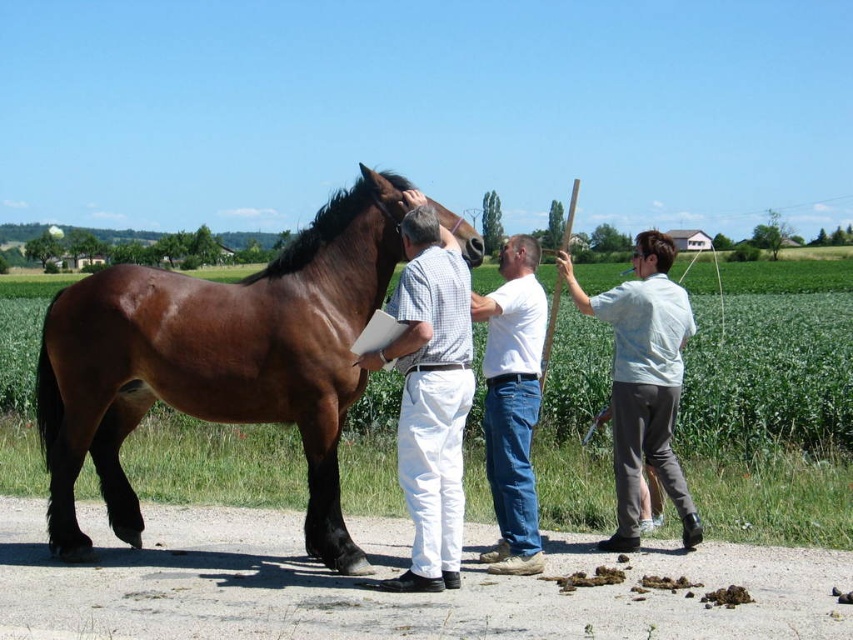
Question: Can you confirm if light blue shirt at right is positioned to the left of white cotton shirt at center?

Choices:
 (A) no
 (B) yes

Answer: (A)

Question: Which of these objects is positioned closest to the brown glossy horse at center?

Choices:
 (A) white cotton shirt at center
 (B) light blue shirt at right
 (C) white cotton pants at center

Answer: (C)

Question: Does light blue shirt at right appear under white cotton shirt at center?

Choices:
 (A) yes
 (B) no

Answer: (B)

Question: Which object appears closest to the camera in this image?

Choices:
 (A) light blue shirt at right
 (B) white cotton pants at center
 (C) white cotton shirt at center

Answer: (B)

Question: Which object is positioned farthest from the white cotton pants at center?

Choices:
 (A) white cotton shirt at center
 (B) light blue shirt at right

Answer: (B)

Question: Is brown glossy horse at center bigger than light blue shirt at right?

Choices:
 (A) no
 (B) yes

Answer: (B)